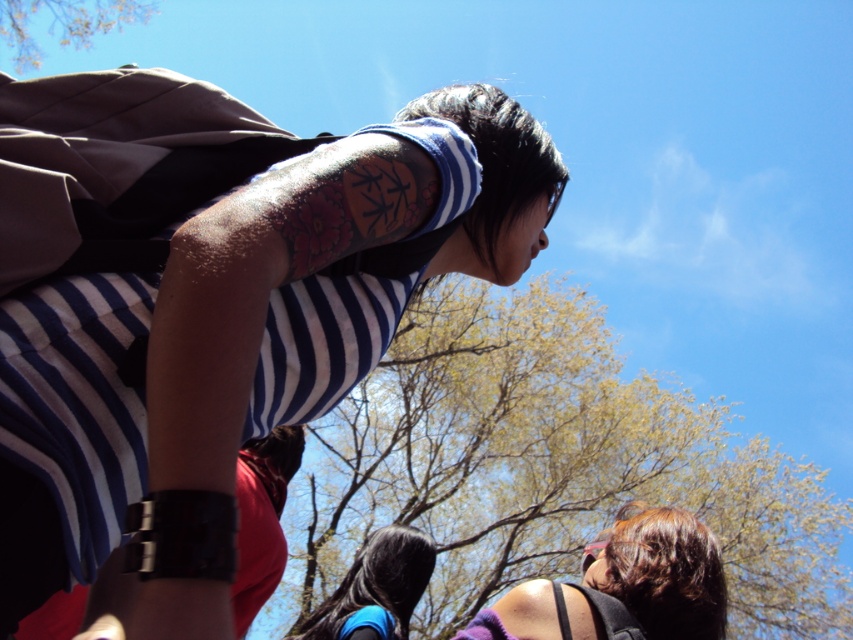
Based on the scene description, which object is larger in the image, the green leafy tree at upper center or the smooth black hair at center?

The green leafy tree at upper center is bigger than the smooth black hair at center.

What is the exact coordinate of the matte purple tank top at lower right?

The matte purple tank top at lower right is located at point (624, 586).

Based on the scene, which object is taller, the green leafy tree at upper center or the smooth black hair at center?

The green leafy tree at upper center is much taller than the smooth black hair at center.